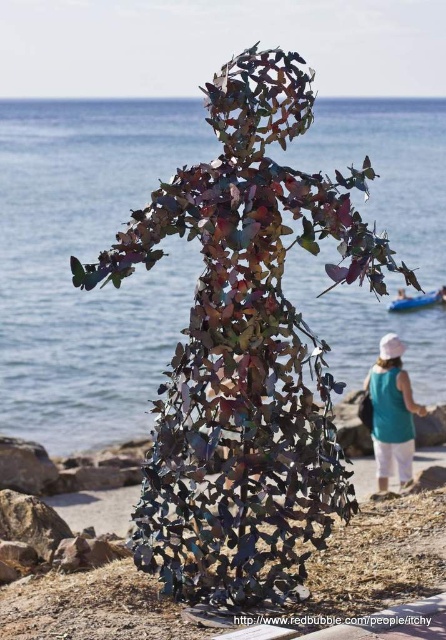
You are a photographer wanting to capture both the metallic leaf sculpture at center and the teal fabric dress at lower right in the same frame. Based on their sizes, do you think you can fit both into the photo without zooming in?

The metallic leaf sculpture at center might be wider than teal fabric dress at lower right, so it is possible to fit both into the photo without zooming in, as the sculpture is likely larger and can be positioned centrally while the dress is placed at the edge of the frame.